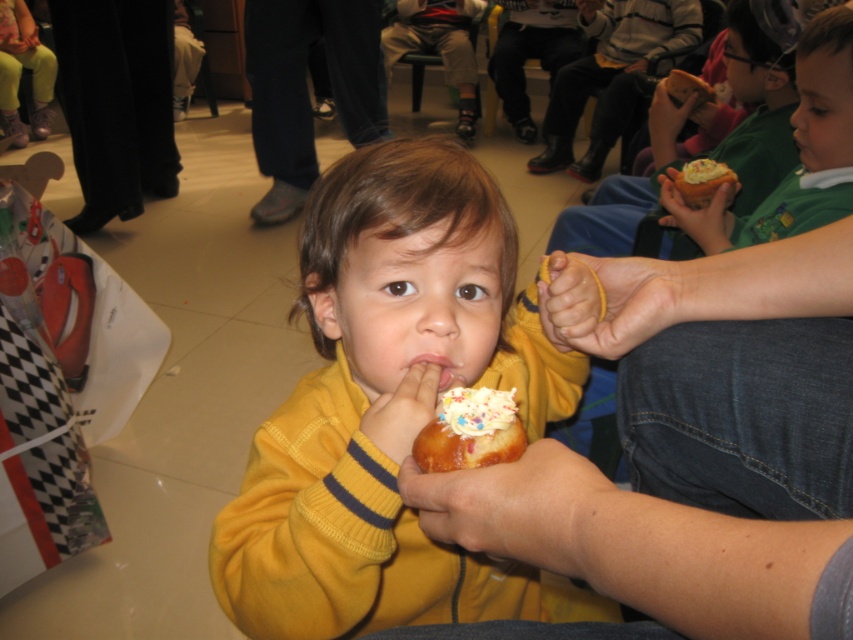
Between matte green shirt at upper right and pink glossy lips at center, which one is positioned higher?

Positioned higher is matte green shirt at upper right.

Is point (730, 220) in front of point (450, 378)?

No, (730, 220) is further to viewer.

This screenshot has height=640, width=853. What are the coordinates of `matte green shirt at upper right` in the screenshot? It's located at (798, 152).

Is point (473, 340) less distant than point (439, 388)?

No.

Is yellow soft sweater at center to the right of pink glossy lips at center from the viewer's perspective?

Incorrect, yellow soft sweater at center is not on the right side of pink glossy lips at center.

Between point (303, 244) and point (434, 360), which one is positioned behind?

Point (303, 244)

Where is `yellow soft sweater at center`? The width and height of the screenshot is (853, 640). yellow soft sweater at center is located at coordinates (386, 403).

Which is above, matte green shirt at upper right or white frosted donut at upper right?

Positioned higher is matte green shirt at upper right.

Who is positioned more to the right, matte green shirt at upper right or white frosted donut at upper right?

matte green shirt at upper right is more to the right.

This screenshot has height=640, width=853. What are the coordinates of `matte green shirt at upper right` in the screenshot? It's located at (798, 152).